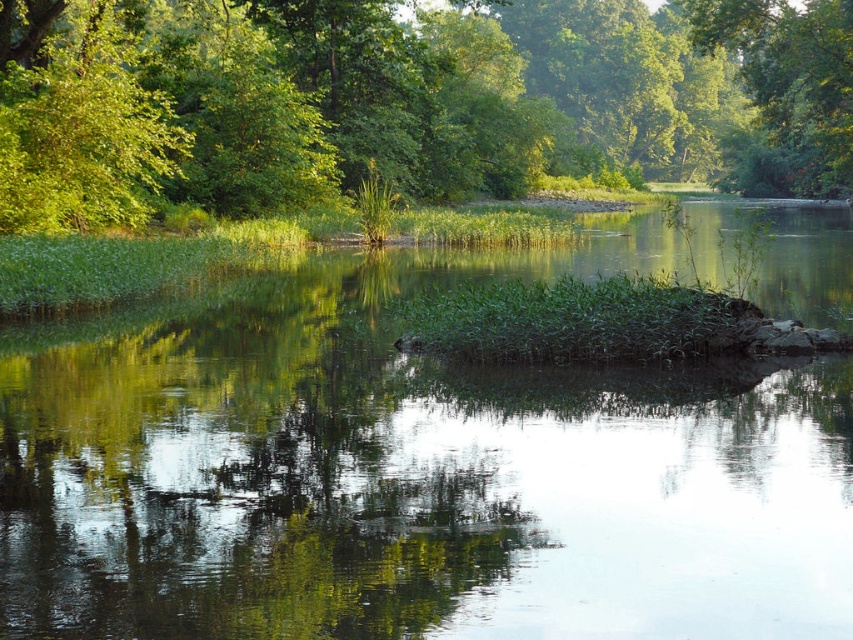
Which is behind, point (74, 12) or point (843, 52)?

Positioned behind is point (843, 52).

Is point (146, 90) positioned in front of point (741, 193)?

Yes, point (146, 90) is closer to viewer.

The width and height of the screenshot is (853, 640). I want to click on green leafy tree at upper left, so click(76, 122).

Who is higher up, transparent water at center or green leafy tree at upper center?

Positioned higher is green leafy tree at upper center.

From the picture: Can you confirm if transparent water at center is positioned to the right of green leafy tree at upper center?

No, transparent water at center is not to the right of green leafy tree at upper center.

Does point (137, 374) lie in front of point (772, 164)?

Yes, it is.

The height and width of the screenshot is (640, 853). Find the location of `transparent water at center`. transparent water at center is located at coordinates (418, 474).

Measure the distance between point [97,20] and camera.

They are 40.14 meters apart.

Does green leafy tree at upper center have a lesser height compared to green leafy tree at upper right?

No.

Does point (779, 109) come in front of point (770, 118)?

Yes, it is in front of point (770, 118).

Find the location of a particular element. green leafy tree at upper center is located at coordinates (405, 99).